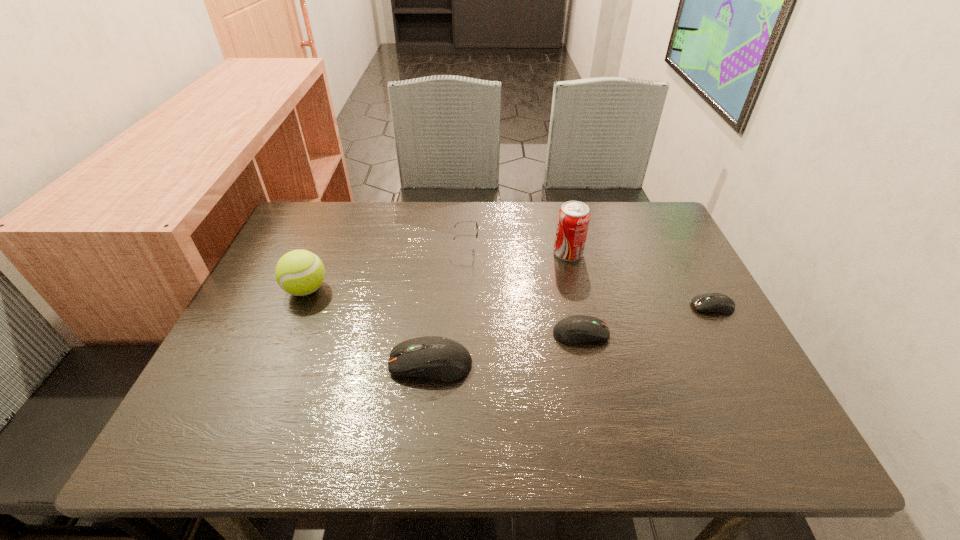
Locate an element on the screen. vacant area at the far right corner of the desktop is located at coordinates (612, 214).

This screenshot has width=960, height=540. In the image, there is a desktop. Identify the location of vacant space at the near right corner. (728, 408).

Identify the location of vacant point located between the sunglasses and the shortest object. (589, 276).

The width and height of the screenshot is (960, 540). Find the location of `free spot between the second shortest object and the third tallest object`. free spot between the second shortest object and the third tallest object is located at coordinates (523, 289).

Where is `vacant region between the tallest object and the rightmost computer equipment`? vacant region between the tallest object and the rightmost computer equipment is located at coordinates (640, 280).

You are a GUI agent. You are given a task and a screenshot of the screen. Output one action in this format:
    pyautogui.click(x=<x>, y=<y>)
    Task: Click on the unoccupied position between the fourth shortest object and the tallest computer equipment
    This screenshot has height=540, width=960.
    Given the screenshot: What is the action you would take?
    pyautogui.click(x=448, y=305)

Find the location of a particular element. free point between the leftmost computer equipment and the leftmost object is located at coordinates (369, 327).

Locate an element on the screen. Image resolution: width=960 pixels, height=540 pixels. free spot between the tallest object and the rightmost computer equipment is located at coordinates (640, 280).

Where is `vacant area that lies between the leftmost object and the third tallest object`? The height and width of the screenshot is (540, 960). vacant area that lies between the leftmost object and the third tallest object is located at coordinates (387, 267).

What are the coordinates of `free space between the second computer equipment from left to right and the sunglasses` in the screenshot? It's located at (523, 289).